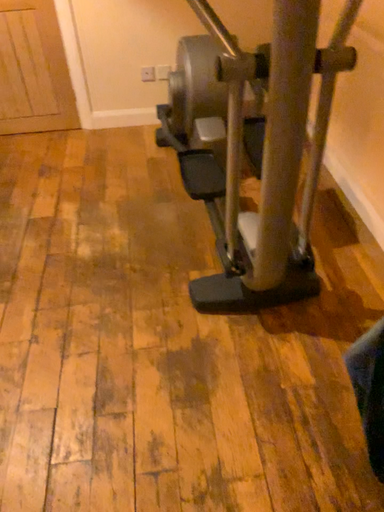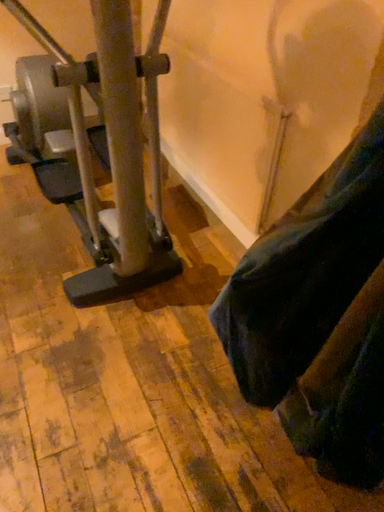
Question: Which way did the camera rotate in the video?

Choices:
 (A) rotated right
 (B) rotated left

Answer: (A)